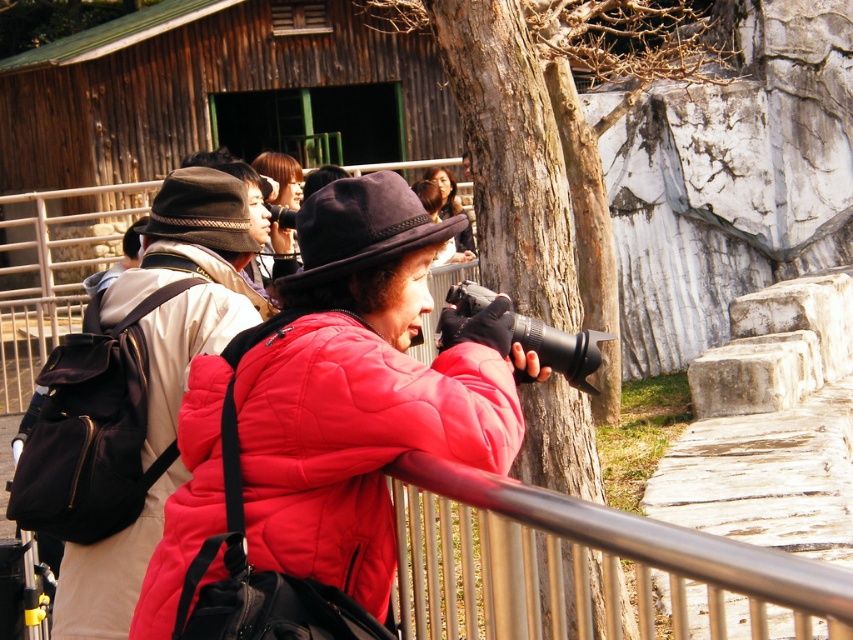
Is matte red puffer jacket at center positioned before matte black backpack at left?

Yes, it is.

Can you confirm if matte red puffer jacket at center is thinner than matte black backpack at left?

No.

What are the coordinates of `matte red puffer jacket at center` in the screenshot? It's located at (326, 445).